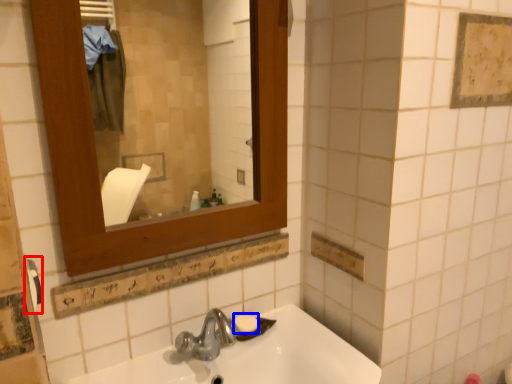
Question: Which point is further to the camera, towel bar (highlighted by a red box) or soap (highlighted by a blue box)?

Choices:
 (A) towel bar
 (B) soap

Answer: (B)